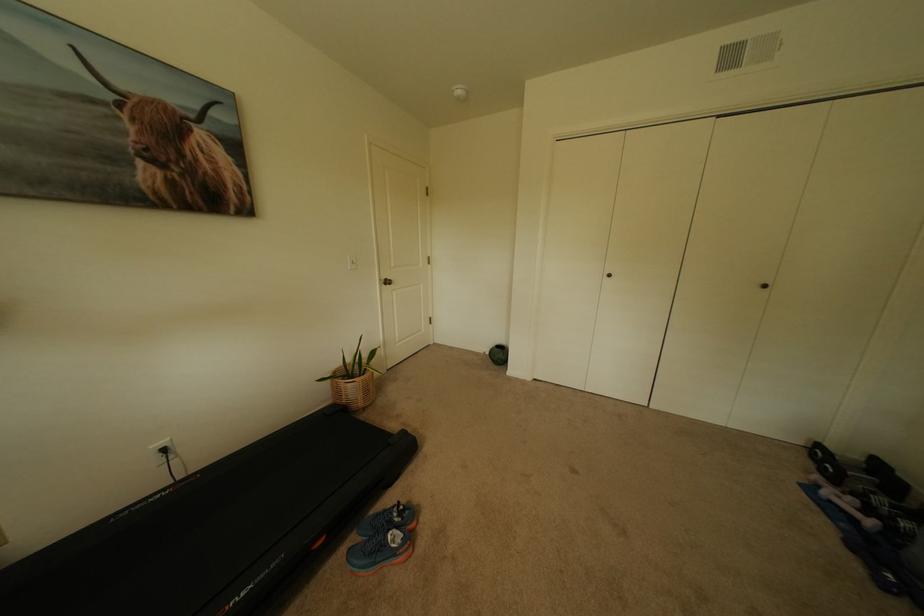
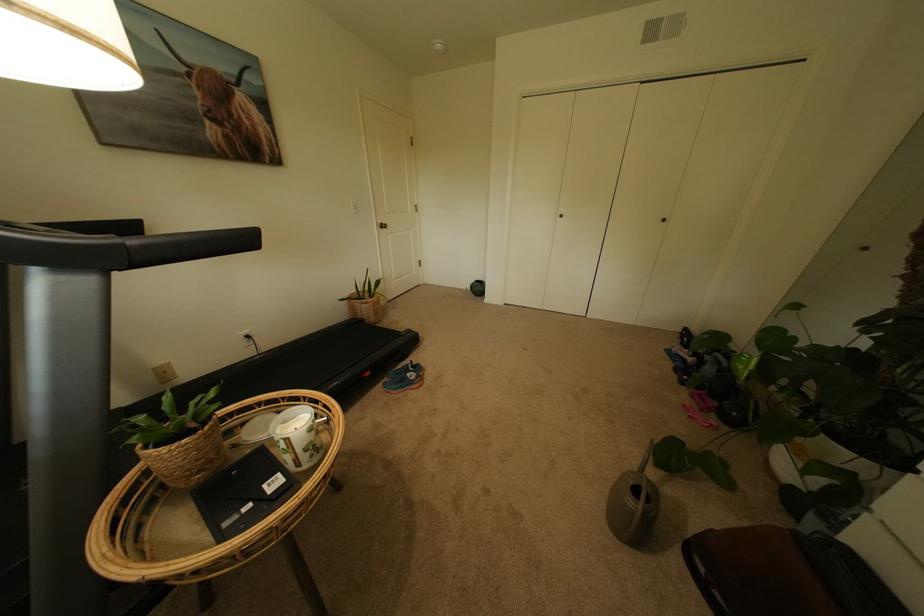
Locate, in the second image, the point that corresponds to (370,395) in the first image.

(382, 314)